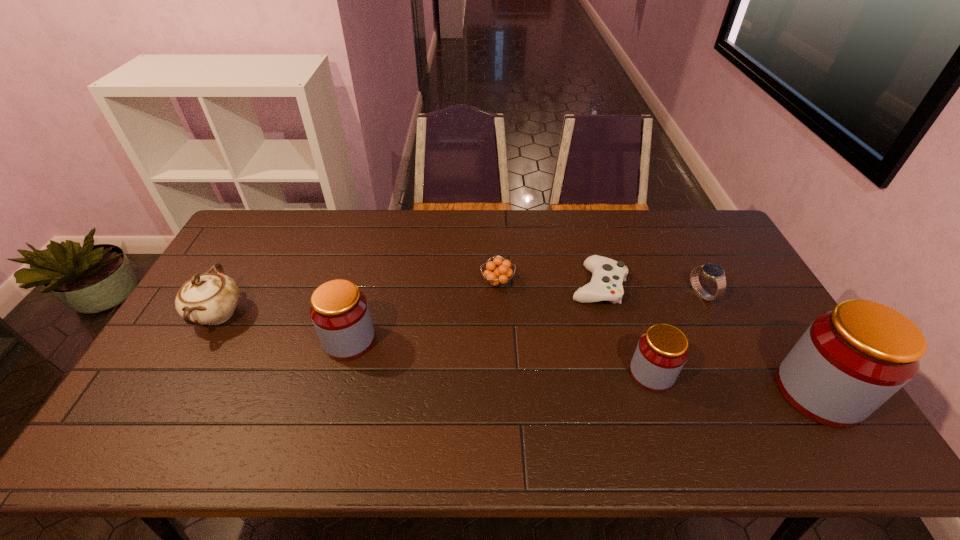
Image resolution: width=960 pixels, height=540 pixels. In order to click on object that is at the near right corner in this screenshot , I will do `click(852, 359)`.

In the image, there is a desktop. Identify the location of vacant space at the far edge. The height and width of the screenshot is (540, 960). coord(635,214).

In the image, there is a desktop. At what (x,y) coordinates should I click in order to perform the action: click on vacant space at the near edge. Please return your answer as a coordinate pair (x, y). The height and width of the screenshot is (540, 960). Looking at the image, I should click on (705, 397).

You are a GUI agent. You are given a task and a screenshot of the screen. Output one action in this format:
    pyautogui.click(x=<x>, y=<y>)
    Task: Click on the vacant space at the left edge of the desktop
    Image resolution: width=960 pixels, height=540 pixels.
    Given the screenshot: What is the action you would take?
    pyautogui.click(x=203, y=332)

Locate an element on the screen. This screenshot has width=960, height=540. vacant space at the far right corner of the desktop is located at coordinates (724, 237).

Locate an element on the screen. free space at the near right corner is located at coordinates (774, 401).

Where is `vacant area that lies between the second object from right to left and the second shortest jar`? This screenshot has width=960, height=540. vacant area that lies between the second object from right to left and the second shortest jar is located at coordinates (525, 317).

Image resolution: width=960 pixels, height=540 pixels. In order to click on free area in between the fifth tallest object and the rightmost object in this screenshot , I will do (760, 343).

You are a GUI agent. You are given a task and a screenshot of the screen. Output one action in this format:
    pyautogui.click(x=<x>, y=<y>)
    Task: Click on the free spot between the sixth object from left to right and the leftmost object
    This screenshot has height=540, width=960.
    Given the screenshot: What is the action you would take?
    pyautogui.click(x=460, y=304)

You are a GUI agent. You are given a task and a screenshot of the screen. Output one action in this format:
    pyautogui.click(x=<x>, y=<y>)
    Task: Click on the free space that is in between the control and the leftmost object
    This screenshot has width=960, height=540.
    Given the screenshot: What is the action you would take?
    pyautogui.click(x=408, y=300)